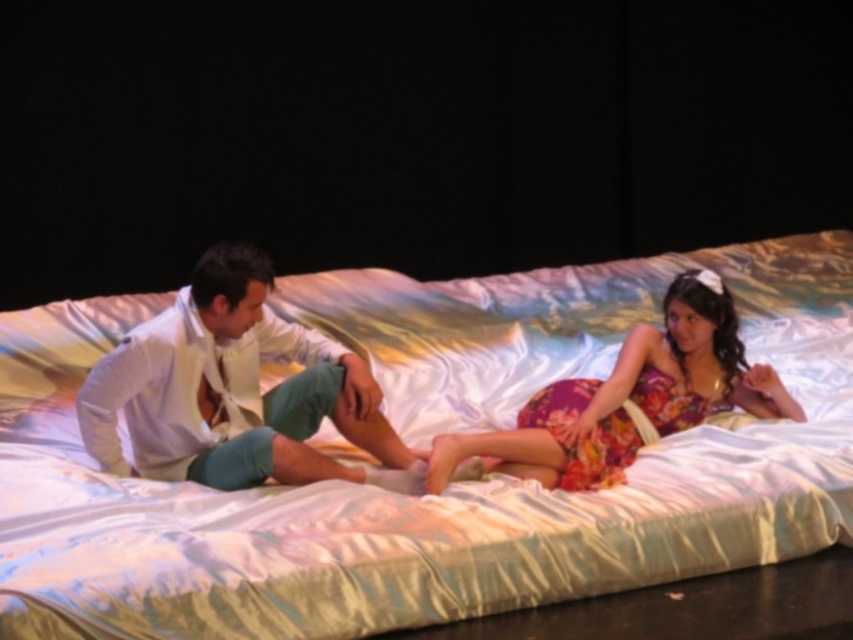
You are a photographer setting up a shoot. You need to position a camera to capture both the silky satin bed at center and the white satin shirt at center in the same frame. Based on their positions, which object should be placed closer to the left side of the camera frame?

The white satin shirt at center should be placed closer to the left side of the camera frame because the silky satin bed at center is positioned to the right of it.

You are a photographer setting up a photoshoot in the scene described. You need to place a small lamp in front of the silky satin bed at center so that it illuminates the floral fabric dress at center. Is this possible given their positions?

The floral fabric dress at center is behind the silky satin bed at center, so placing the lamp in front of the silky satin bed at center would not allow light to reach the floral fabric dress at center since it is blocked by the bed.

You are an observer looking at the scene. There are two points marked in the image, point 1 at coordinates point (190, 387) and point 2 at coordinates point (682, 291). Which point is closer to you?

Point (190, 387) is closer to the viewer than point (682, 291).